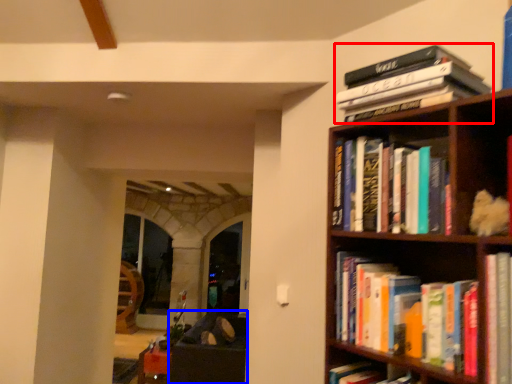
Question: Which point is closer to the camera, book (highlighted by a red box) or furniture (highlighted by a blue box)?

Choices:
 (A) book
 (B) furniture

Answer: (A)